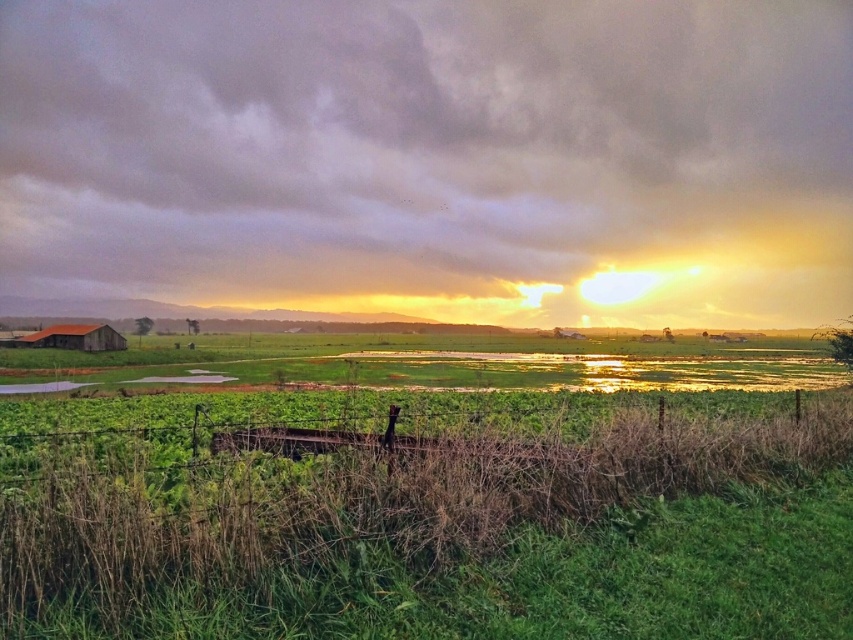
What do you see at coordinates (351, 508) in the screenshot? I see `green grassy field at lower center` at bounding box center [351, 508].

Which is more to the right, green grassy field at lower center or rustic wooden barn at lower left?

green grassy field at lower center is more to the right.

Between point (456, 520) and point (79, 349), which one is positioned in front?

Point (456, 520) is more forward.

The height and width of the screenshot is (640, 853). In order to click on green grassy field at lower center in this screenshot , I will do `click(351, 508)`.

Does point (439, 196) come closer to viewer compared to point (76, 545)?

No, (439, 196) is further to viewer.

Is cloudy sky at upper center further to camera compared to green grassy field at lower center?

Yes, it is.

Does point (25, 259) lie behind point (184, 579)?

Yes, it is behind point (184, 579).

Locate an element on the screen. Image resolution: width=853 pixels, height=640 pixels. cloudy sky at upper center is located at coordinates (425, 150).

Does cloudy sky at upper center have a greater height compared to rustic wooden barn at lower left?

Yes.

Is point (566, 120) positioned before point (109, 339)?

That is False.

The height and width of the screenshot is (640, 853). In order to click on cloudy sky at upper center in this screenshot , I will do point(425,150).

Locate an element on the screen. cloudy sky at upper center is located at coordinates (425, 150).